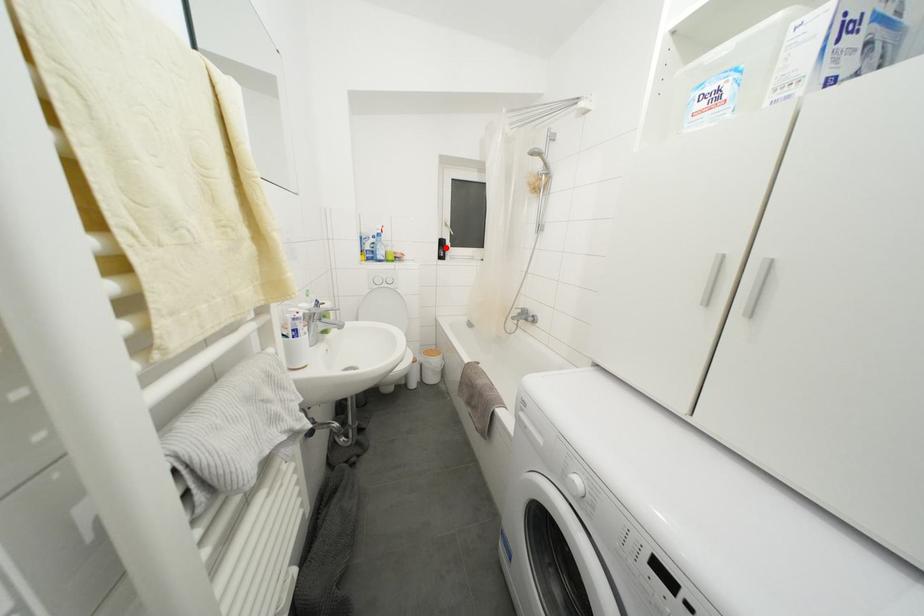
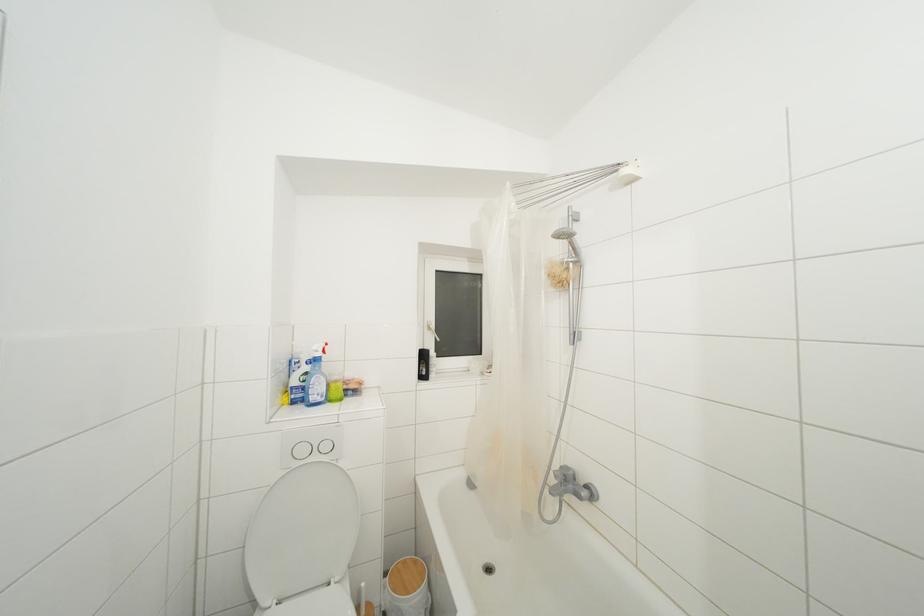
Question: I am providing you with two images of the same scene from different viewpoints. A red point is shown in image1. For the corresponding object point in image2, is it positioned nearer or farther from the camera?

Choices:
 (A) Nearer
 (B) Farther

Answer: (B)